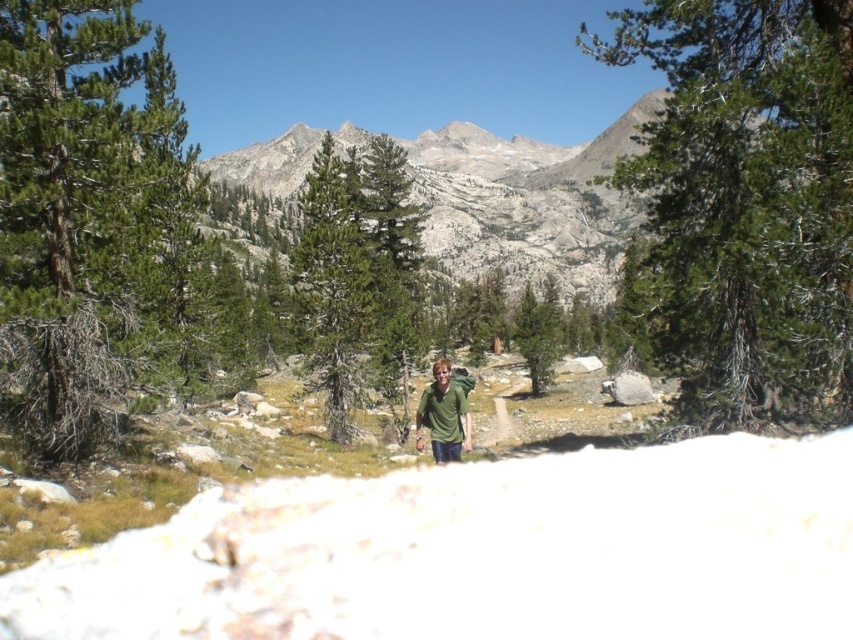
Does green needle-like at center appear on the right side of green matte tree at center?

Yes, green needle-like at center is to the right of green matte tree at center.

Is green needle-like at center wider than green matte tree at center?

Yes.

Is point (634, 52) closer to viewer compared to point (538, 356)?

Yes.

I want to click on green needle-like at center, so click(747, 202).

Does rocky gray mountain at upper center appear on the right side of green matte tree at center?

Incorrect, rocky gray mountain at upper center is not on the right side of green matte tree at center.

Who is lower down, rocky gray mountain at upper center or green matte tree at center?

green matte tree at center is below.

Does point (596, 163) come behind point (518, 307)?

Yes, point (596, 163) is behind point (518, 307).

You are a GUI agent. You are given a task and a screenshot of the screen. Output one action in this format:
    pyautogui.click(x=<x>, y=<y>)
    Task: Click on the rocky gray mountain at upper center
    Image resolution: width=853 pixels, height=640 pixels.
    Given the screenshot: What is the action you would take?
    pyautogui.click(x=527, y=202)

Consider the image. Who is higher up, green rough bark tree at center or green matte tree at center?

Positioned higher is green rough bark tree at center.

The height and width of the screenshot is (640, 853). Describe the element at coordinates (329, 289) in the screenshot. I see `green rough bark tree at center` at that location.

This screenshot has height=640, width=853. Describe the element at coordinates (329, 289) in the screenshot. I see `green rough bark tree at center` at that location.

The image size is (853, 640). Find the location of `green rough bark tree at center`. green rough bark tree at center is located at coordinates (329, 289).